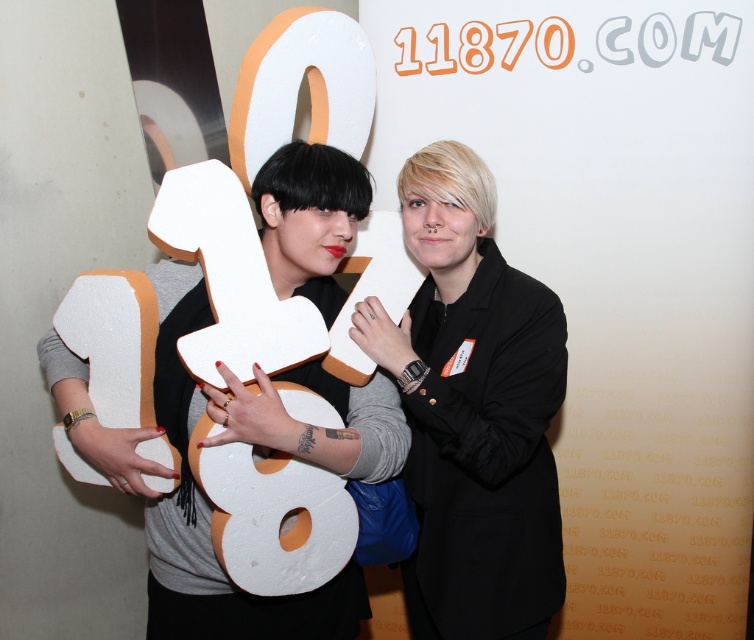
Question: Is black matte jacket at center to the right of white foam number at center from the viewer's perspective?

Choices:
 (A) yes
 (B) no

Answer: (A)

Question: Among these points, which one is nearest to the camera?

Choices:
 (A) (348, 244)
 (B) (461, 218)

Answer: (A)

Question: Is black matte jacket at center positioned behind white foam number at center?

Choices:
 (A) no
 (B) yes

Answer: (B)

Question: Among these points, which one is farthest from the camera?

Choices:
 (A) (277, 224)
 (B) (516, 636)

Answer: (B)

Question: Is black matte jacket at center in front of white foam number at center?

Choices:
 (A) no
 (B) yes

Answer: (A)